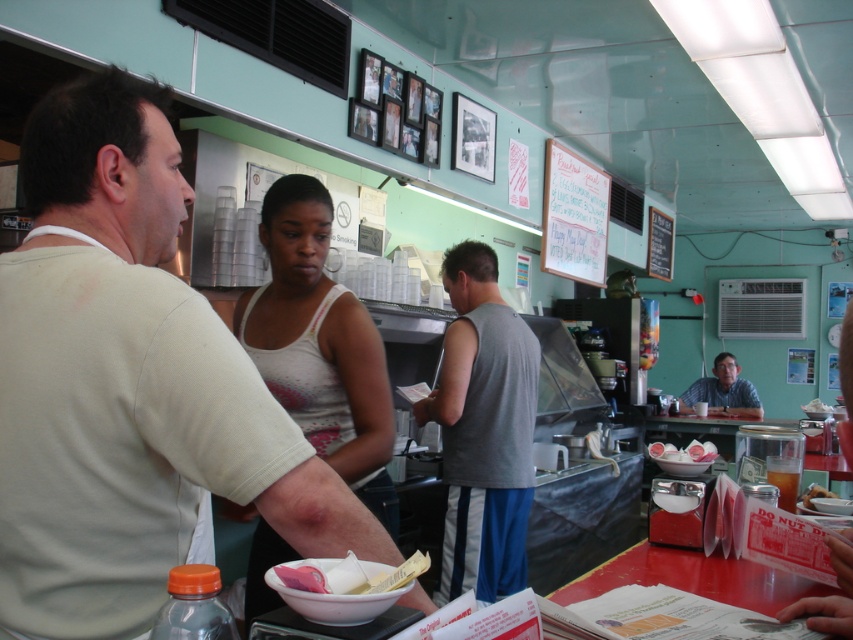
Question: Which point is farther to the camera?

Choices:
 (A) (62, 134)
 (B) (368, 458)

Answer: (B)

Question: Does light beige t-shirt at center appear on the right side of matte gray shirt at upper right?

Choices:
 (A) yes
 (B) no

Answer: (B)

Question: Which object is positioned closest to the light beige t-shirt at center?

Choices:
 (A) white tank top at center
 (B) golden brown donut at right

Answer: (A)

Question: Does matte gray shirt at upper right appear under golden brown donut at right?

Choices:
 (A) no
 (B) yes

Answer: (B)

Question: Which of the following is the closest to the observer?

Choices:
 (A) white paperboard at upper center
 (B) golden brown donut at right

Answer: (B)

Question: Is gray fabric tank top at center positioned at the back of golden brown donut at right?

Choices:
 (A) yes
 (B) no

Answer: (A)